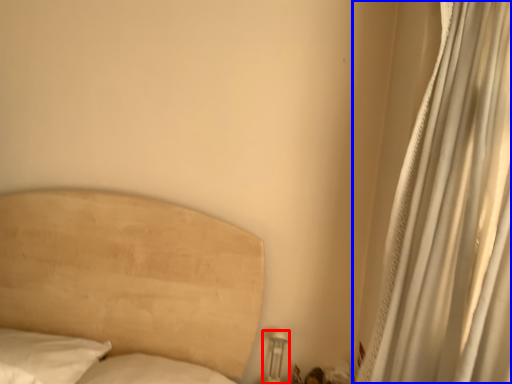
Question: Which of the following is the farthest to the observer, table lamp (highlighted by a red box) or curtain (highlighted by a blue box)?

Choices:
 (A) table lamp
 (B) curtain

Answer: (A)